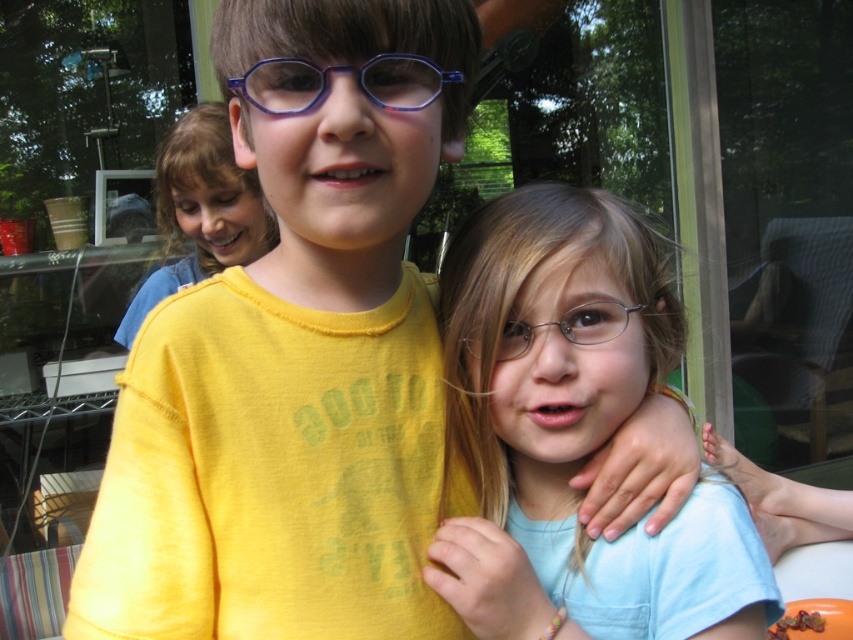
Is matte yellow shirt at upper center positioned behind clear plastic glasses at center?

Yes, matte yellow shirt at upper center is behind clear plastic glasses at center.

What do you see at coordinates (200, 211) in the screenshot? The image size is (853, 640). I see `matte yellow shirt at upper center` at bounding box center [200, 211].

This screenshot has width=853, height=640. In order to click on matte yellow shirt at upper center in this screenshot , I will do `click(200, 211)`.

What do you see at coordinates (573, 433) in the screenshot?
I see `light blue t-shirt at center` at bounding box center [573, 433].

Can you confirm if light blue t-shirt at center is positioned to the right of clear plastic glasses at center?

Yes, light blue t-shirt at center is to the right of clear plastic glasses at center.

What do you see at coordinates (573, 433) in the screenshot? The image size is (853, 640). I see `light blue t-shirt at center` at bounding box center [573, 433].

Locate an element on the screen. This screenshot has height=640, width=853. light blue t-shirt at center is located at coordinates (573, 433).

Who is more distant from viewer, [265,241] or [296,100]?

Positioned behind is point [265,241].

This screenshot has height=640, width=853. Describe the element at coordinates (200, 211) in the screenshot. I see `matte yellow shirt at upper center` at that location.

Between point (194, 129) and point (367, 83), which one is positioned behind?

The point (194, 129) is behind.

Locate an element on the screen. matte yellow shirt at upper center is located at coordinates (200, 211).